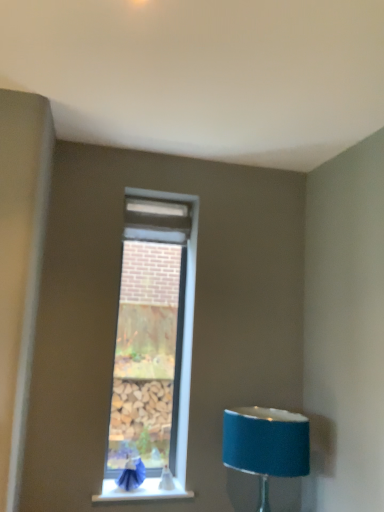
Question: Can you see white smooth window sill at lower center touching blue fabric lampshade at lower right?

Choices:
 (A) no
 (B) yes

Answer: (A)

Question: Is white smooth window sill at lower center far from blue fabric lampshade at lower right?

Choices:
 (A) yes
 (B) no

Answer: (B)

Question: From the image's perspective, is white smooth window sill at lower center on top of blue fabric lampshade at lower right?

Choices:
 (A) no
 (B) yes

Answer: (A)

Question: From the image's perspective, does white smooth window sill at lower center appear lower than blue fabric lampshade at lower right?

Choices:
 (A) no
 (B) yes

Answer: (B)

Question: Is white smooth window sill at lower center thinner than blue fabric lampshade at lower right?

Choices:
 (A) yes
 (B) no

Answer: (A)

Question: Is blue fabric lampshade at lower right taller or shorter than blue fabric swivel chair at lower left?

Choices:
 (A) short
 (B) tall

Answer: (B)

Question: Would you say blue fabric lampshade at lower right is to the left or to the right of blue fabric swivel chair at lower left in the picture?

Choices:
 (A) right
 (B) left

Answer: (A)

Question: In terms of size, does blue fabric lampshade at lower right appear bigger or smaller than blue fabric swivel chair at lower left?

Choices:
 (A) small
 (B) big

Answer: (B)

Question: Is blue fabric lampshade at lower right in front of or behind blue fabric swivel chair at lower left in the image?

Choices:
 (A) behind
 (B) front

Answer: (B)

Question: From the image's perspective, is white smooth window sill at lower center above or below blue fabric lampshade at lower right?

Choices:
 (A) below
 (B) above

Answer: (A)

Question: Is white smooth window sill at lower center to the left or to the right of blue fabric lampshade at lower right in the image?

Choices:
 (A) right
 (B) left

Answer: (B)

Question: Is white smooth window sill at lower center situated inside blue fabric lampshade at lower right or outside?

Choices:
 (A) outside
 (B) inside

Answer: (A)

Question: Considering the positions of point (142, 494) and point (231, 453), is point (142, 494) closer or farther from the camera than point (231, 453)?

Choices:
 (A) closer
 (B) farther

Answer: (B)

Question: Is white smooth window sill at lower center spatially inside blue fabric swivel chair at lower left, or outside of it?

Choices:
 (A) inside
 (B) outside

Answer: (B)

Question: Does point (105, 489) appear closer or farther from the camera than point (130, 462)?

Choices:
 (A) closer
 (B) farther

Answer: (A)